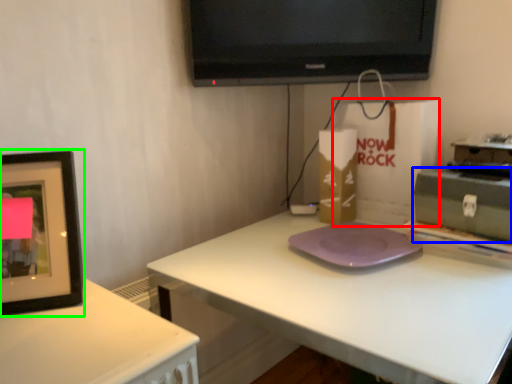
Question: Which object is positioned farthest from paper bag (highlighted by a red box)? Select from box (highlighted by a blue box) and picture frame (highlighted by a green box).

Choices:
 (A) box
 (B) picture frame

Answer: (B)